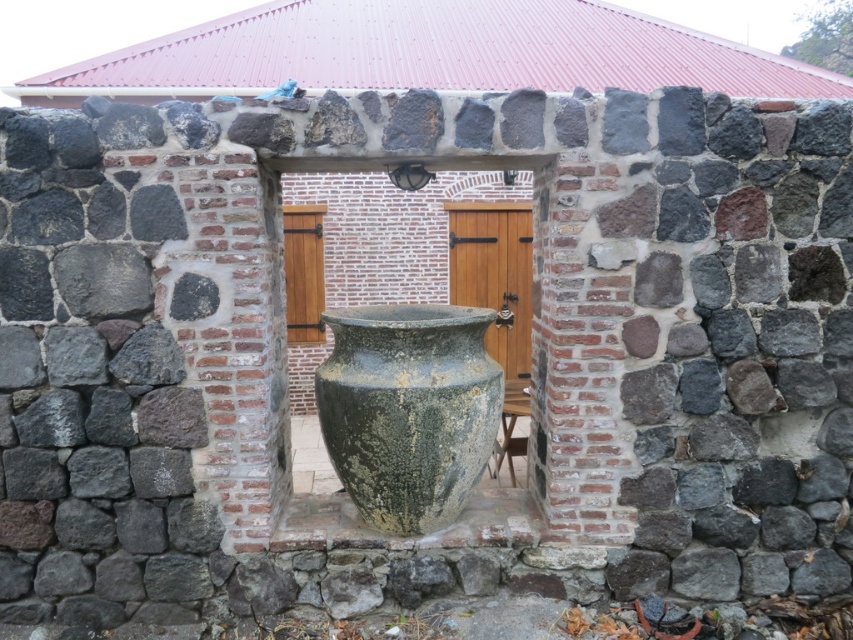
You are standing in the courtyard looking at the stone wall with the archway. You see a green mossy stone vase at center and a wooden stool at center. Which object is positioned to the left of the other?

The green mossy stone vase at center is to the left of the wooden stool at center.

You are a visitor standing in front of the stone wall with the archway. You see a green mossy stone vase at center and a wooden stool at center. Which object is higher up?

The green mossy stone vase at center is above the wooden stool at center, so the green mossy stone vase at center is higher up.

You are an interior designer planning to place a new decorative item in the courtyard. You have a narrow decorative item that is 30 cm wide. You want to place it between the green mossy stone vase at center and the wooden stool at center. Can the space between them accommodate the item?

The green mossy stone vase at center is wider than the wooden stool at center. Since the vase is wider, the space between them might be sufficient for the 30 cm wide decorative item, but the exact width isn